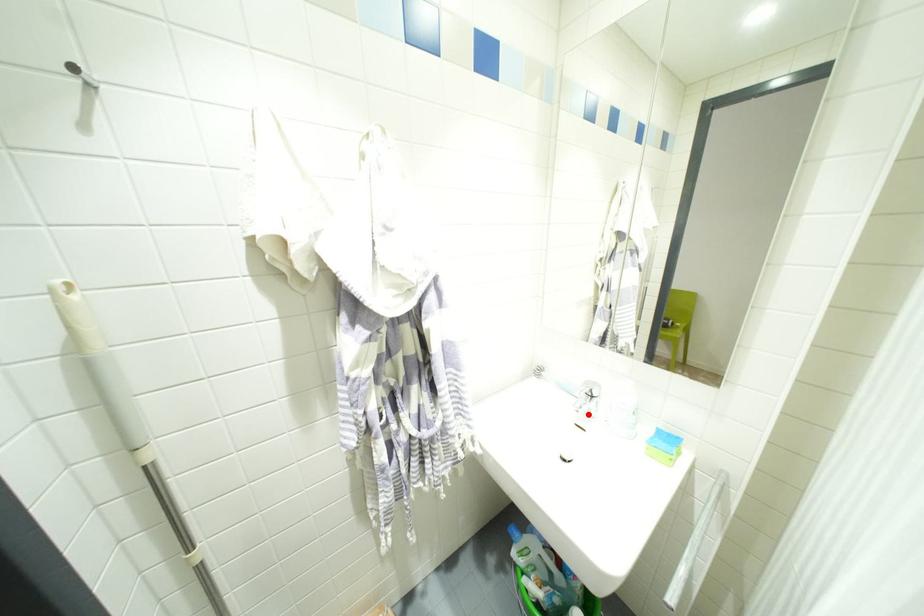
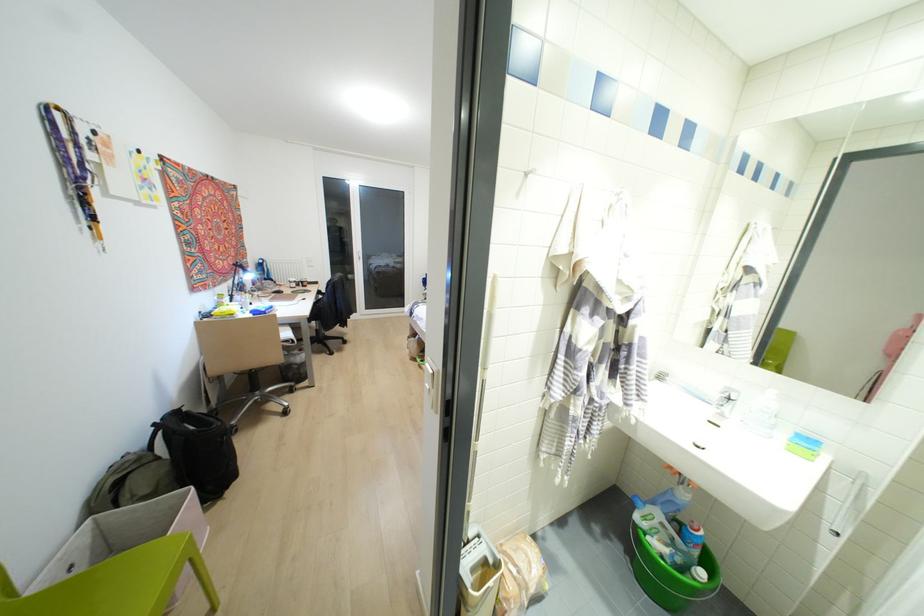
In the second image, find the point that corresponds to the highlighted location in the first image.

(721, 415)